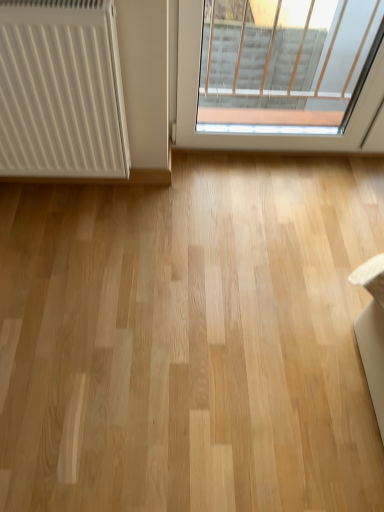
The image size is (384, 512). I want to click on free spot below white matte radiator at left (from a real-world perspective), so click(x=76, y=192).